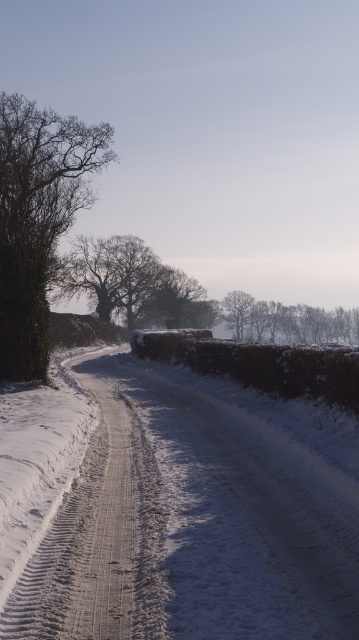
Image resolution: width=359 pixels, height=640 pixels. Describe the element at coordinates (174, 508) in the screenshot. I see `snowy asphalt road at center` at that location.

The image size is (359, 640). What do you see at coordinates (174, 508) in the screenshot?
I see `snowy asphalt road at center` at bounding box center [174, 508].

I want to click on snowy asphalt road at center, so click(x=174, y=508).

Does bare branches at center have a smaller size compared to smooth brown tree at center?

Incorrect, bare branches at center is not smaller in size than smooth brown tree at center.

Does point (207, 305) come in front of point (241, 326)?

Yes, it is in front of point (241, 326).

At what (x,y) coordinates should I click in order to perform the action: click on bare branches at center. Please return your answer as a coordinate pair (x, y). The height and width of the screenshot is (640, 359). Looking at the image, I should click on (129, 282).

Based on the photo, does bare branches at center have a smaller size compared to snowy bare trees at center?

Yes, bare branches at center is smaller than snowy bare trees at center.

Does bare branches at center appear under snowy bare trees at center?

Actually, bare branches at center is above snowy bare trees at center.

Locate an element on the screen. The height and width of the screenshot is (640, 359). bare branches at center is located at coordinates (129, 282).